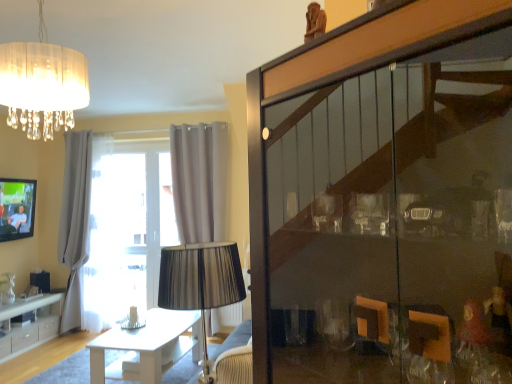
Question: Is point (38, 337) closer or farther from the camera than point (7, 205)?

Choices:
 (A) farther
 (B) closer

Answer: (B)

Question: Is white glossy cabinet at lower left spatially inside matte black tv at left, or outside of it?

Choices:
 (A) outside
 (B) inside

Answer: (A)

Question: Estimate the real-world distances between objects in this image. Which object is closer to the clear glass vase at lower left?

Choices:
 (A) white pleated curtain at center, marked as the 2th curtain in a left-to-right arrangement
 (B) matte black tv at left
 (C) white sheer curtain at left, marked as the 2th curtain in a right-to-left arrangement
 (D) translucent fabric chandelier at upper left
 (E) white glossy table at center

Answer: (B)

Question: Estimate the real-world distances between objects in this image. Which object is farther from the white glossy cabinet at lower left?

Choices:
 (A) matte black tv at left
 (B) translucent fabric chandelier at upper left
 (C) clear glass vase at lower left
 (D) white sheer curtain at left, marked as the 2th curtain in a right-to-left arrangement
 (E) white glossy table at center

Answer: (B)